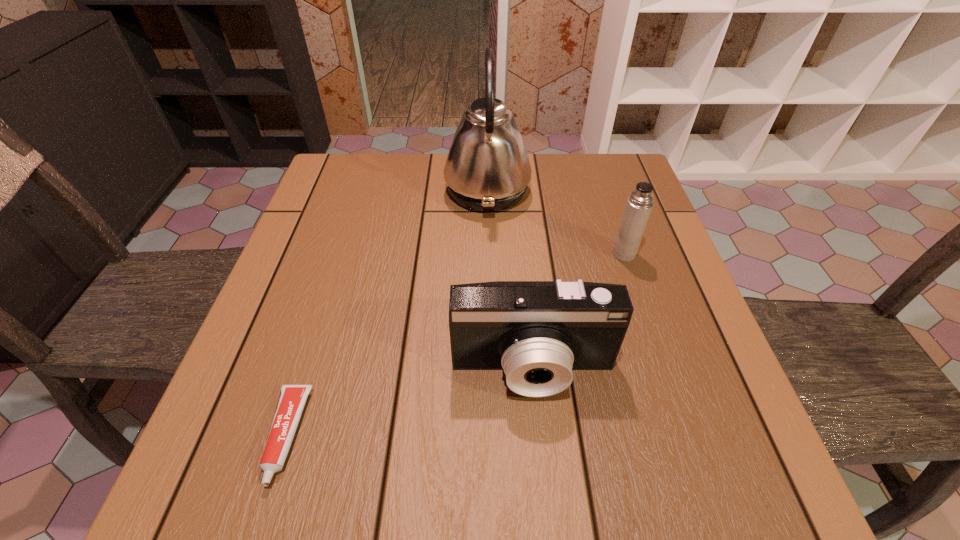
Identify the location of blank space at the right edge. This screenshot has width=960, height=540. (732, 390).

Find the location of a particular element. This screenshot has width=960, height=540. vacant space at the far left corner of the desktop is located at coordinates (374, 177).

The width and height of the screenshot is (960, 540). Identify the location of free space at the near left corner of the desktop. (199, 509).

In order to click on blank space at the far right corner of the desktop in this screenshot , I will do `click(613, 183)`.

Locate an element on the screen. Image resolution: width=960 pixels, height=540 pixels. free space at the near right corner of the desktop is located at coordinates (709, 503).

Where is `vacant area that lies between the farthest object and the leftmost object`? This screenshot has height=540, width=960. vacant area that lies between the farthest object and the leftmost object is located at coordinates [387, 313].

Find the location of a particular element. This screenshot has height=540, width=960. vacant area between the camcorder and the tallest object is located at coordinates (510, 280).

Where is `empty space between the camcorder and the toothpaste`? The height and width of the screenshot is (540, 960). empty space between the camcorder and the toothpaste is located at coordinates (409, 403).

Identify the location of empty space between the toothpaste and the camcorder. The height and width of the screenshot is (540, 960). (409, 403).

Locate an element on the screen. The width and height of the screenshot is (960, 540). vacant space that is in between the camcorder and the kettle is located at coordinates (510, 280).